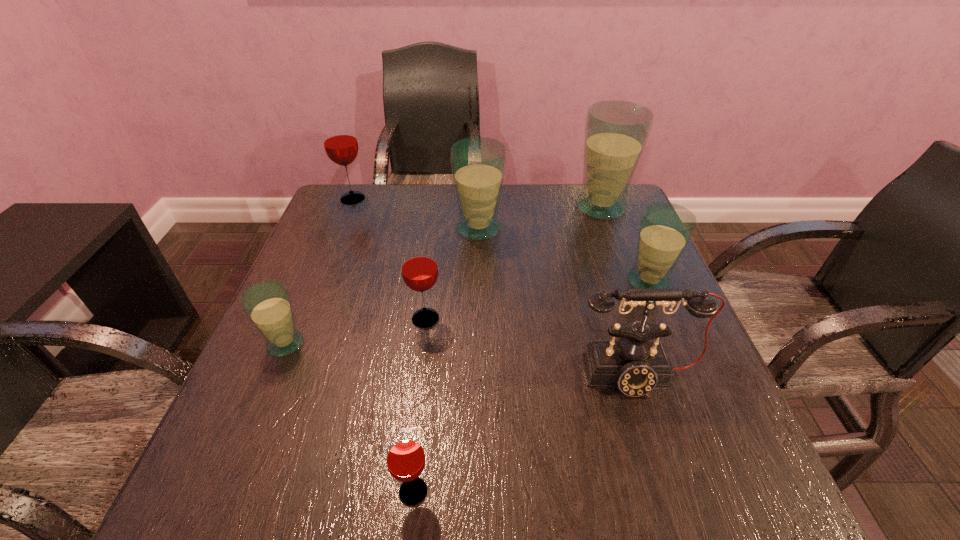
Image resolution: width=960 pixels, height=540 pixels. Identify the location of free space at the far left corner of the desktop. (348, 209).

The image size is (960, 540). Find the location of `free area in between the leftmost red glass and the fourth farthest glass`. free area in between the leftmost red glass and the fourth farthest glass is located at coordinates (500, 240).

Identify the location of unoccupied area between the fifth nearest object and the leftmost blue glass. (467, 313).

Locate an element on the screen. free space between the nearest glass and the fifth nearest object is located at coordinates (531, 387).

The image size is (960, 540). Find the location of `free space between the second smallest red glass and the nearest red glass`. free space between the second smallest red glass and the nearest red glass is located at coordinates (420, 405).

Where is `empty space that is in between the smallest red glass and the telephone`? empty space that is in between the smallest red glass and the telephone is located at coordinates (524, 434).

This screenshot has height=540, width=960. What are the coordinates of `free space between the nearest glass and the second nearest red glass` in the screenshot? It's located at (420, 405).

Find the location of a particular element. The image size is (960, 540). vacant region between the black telephone and the biggest red glass is located at coordinates (494, 287).

The width and height of the screenshot is (960, 540). In order to click on free area in between the second biggest red glass and the telephone in this screenshot , I will do `click(531, 347)`.

Where is `the fourth closest object to the biggest blue glass`? This screenshot has width=960, height=540. the fourth closest object to the biggest blue glass is located at coordinates (419, 268).